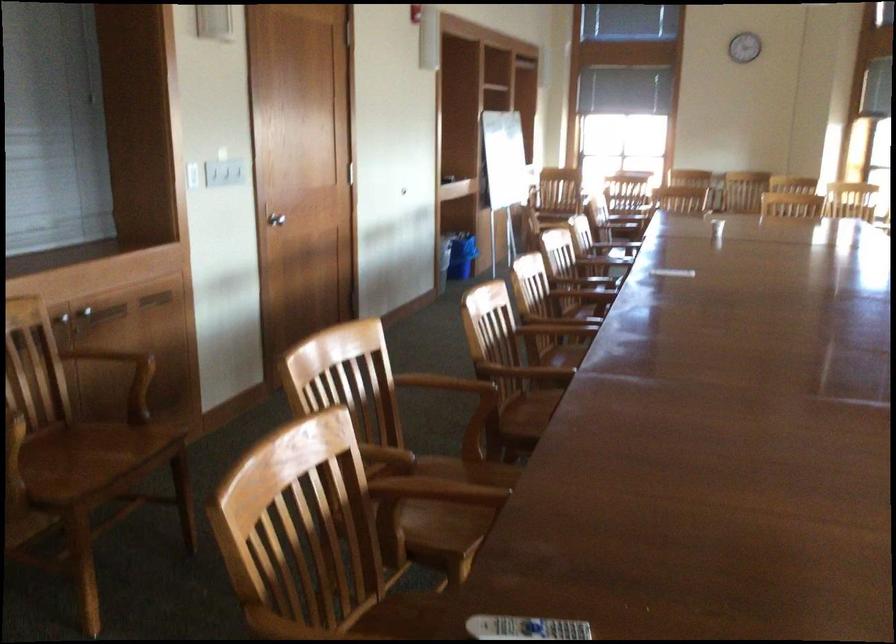
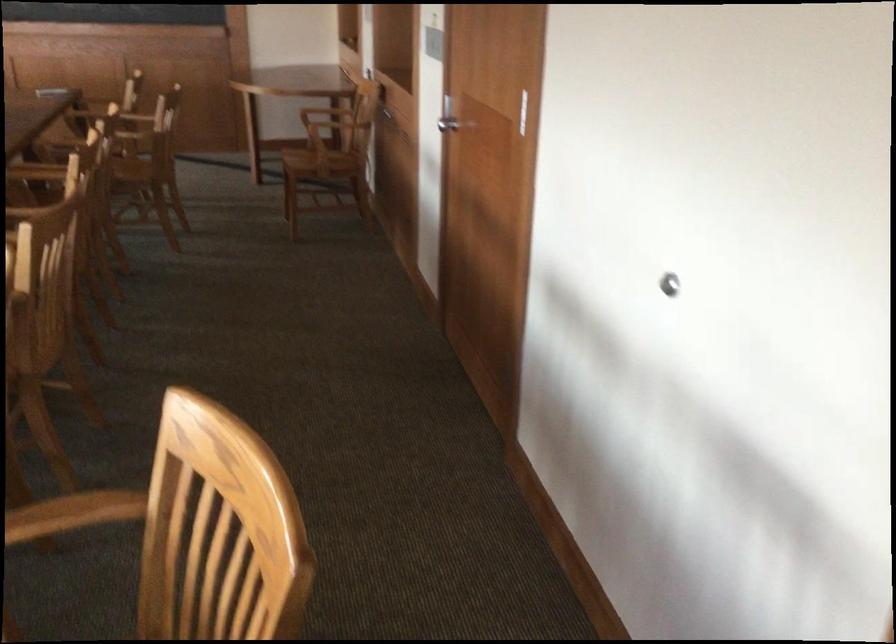
Question: I am providing you with two images of the same scene from different viewpoints. Which of the following objects are not visible in image2?

Choices:
 (A) pink cushioned surface
 (B) wooden chair sitting surface
 (C) chair armrest
 (D) silver wall stop

Answer: (B)